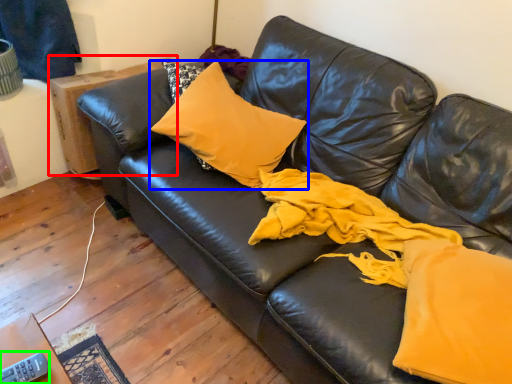
Question: Which is farther away from table (highlighted by a red box)? pillow (highlighted by a blue box) or remote (highlighted by a green box)?

Choices:
 (A) pillow
 (B) remote

Answer: (B)